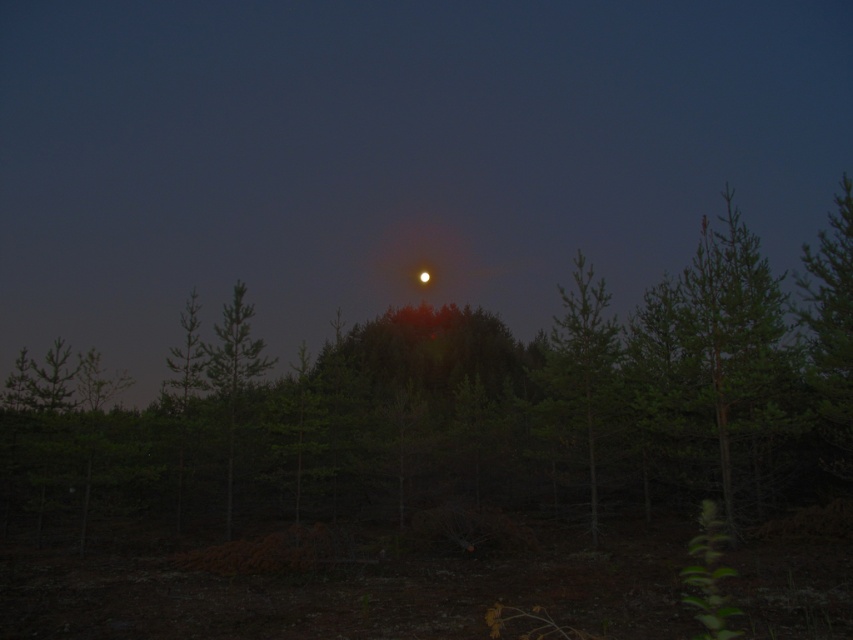
You are standing in the forest at night and see the two green matte trees. Which tree is closer to you, the green matte tree at right or the green matte tree at left?

The green matte tree at right is closer to you because it is positioned over the green matte tree at left, indicating it is in front.

You are standing in a forest at night and want to take a photo of the green matte tree at center. If your camera has a maximum focus range of 15 meters, will it be able to capture the tree clearly?

The green matte tree at center and camera are 17.55 meters apart from each other. Since the camera can only focus up to 15 meters, it will not be able to capture the tree clearly.

You are standing in the forest at night and notice two green matte trees. Which tree is narrower between the green matte tree at right and the green matte tree at left?

The green matte tree at right is narrower than the green matte tree at left.